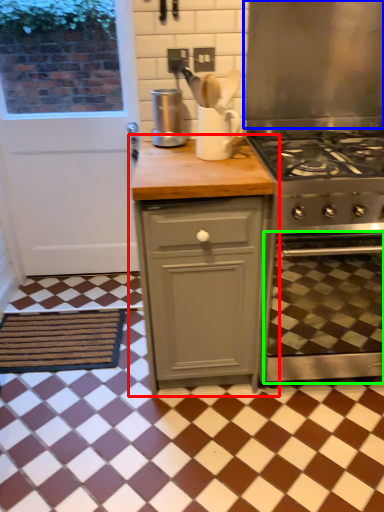
Question: Which object is positioned farthest from cabinetry (highlighted by a red box)? Select from exhaust hood (highlighted by a blue box) and oven (highlighted by a green box).

Choices:
 (A) exhaust hood
 (B) oven

Answer: (A)